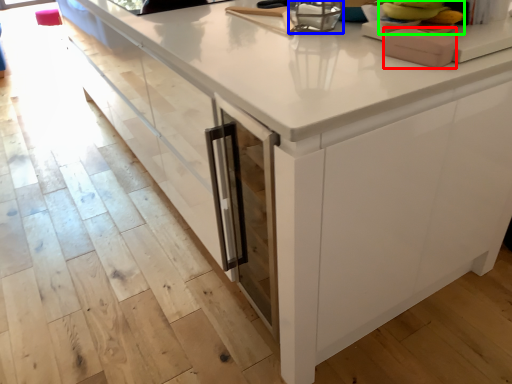
Question: Considering the real-world distances, which object is closest to appliance (highlighted by a red box)? appliance (highlighted by a blue box) or food (highlighted by a green box).

Choices:
 (A) appliance
 (B) food

Answer: (B)